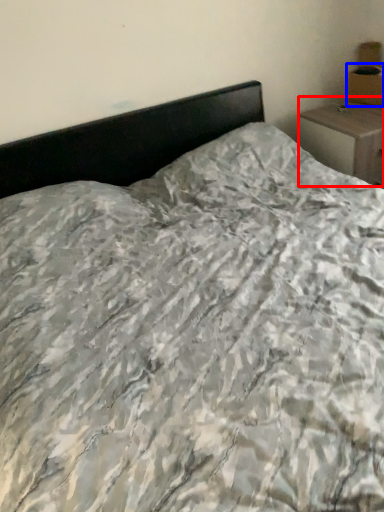
Question: Which of the following is the farthest to the observer, nightstand (highlighted by a red box) or cardboard box (highlighted by a blue box)?

Choices:
 (A) nightstand
 (B) cardboard box

Answer: (B)